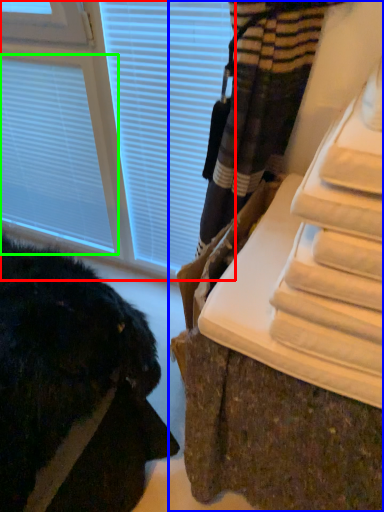
Question: Based on their relative distances, which object is nearer to window (highlighted by a red box)? Choose from furniture (highlighted by a blue box) and blind (highlighted by a green box).

Choices:
 (A) furniture
 (B) blind

Answer: (B)